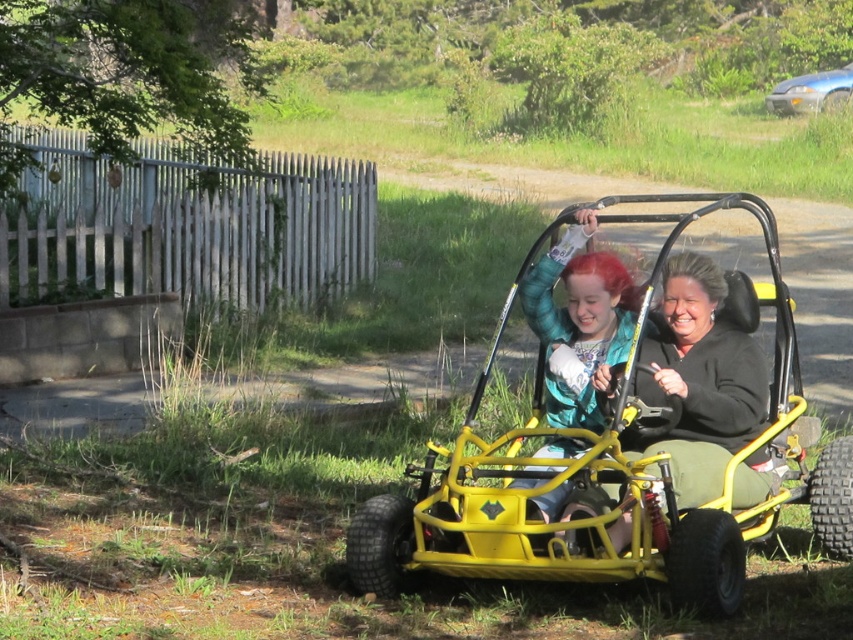
You are a delivery person trying to reach the metallic blue sedan at upper right parked behind the matte black jacket at center. Can you drive through the space between them?

The matte black jacket at center is in front of the metallic blue sedan at upper right, so you cannot drive through the space between them as they are positioned one in front of the other.

You are a delivery person who needs to park your vehicle in the parking lot. You see the matte black jacket at center and the metallic blue sedan at upper right. Which object is closer to the parking lot entrance?

The matte black jacket at center is closer to the parking lot entrance because it is positioned to the left of the metallic blue sedan at upper right, which is further away.